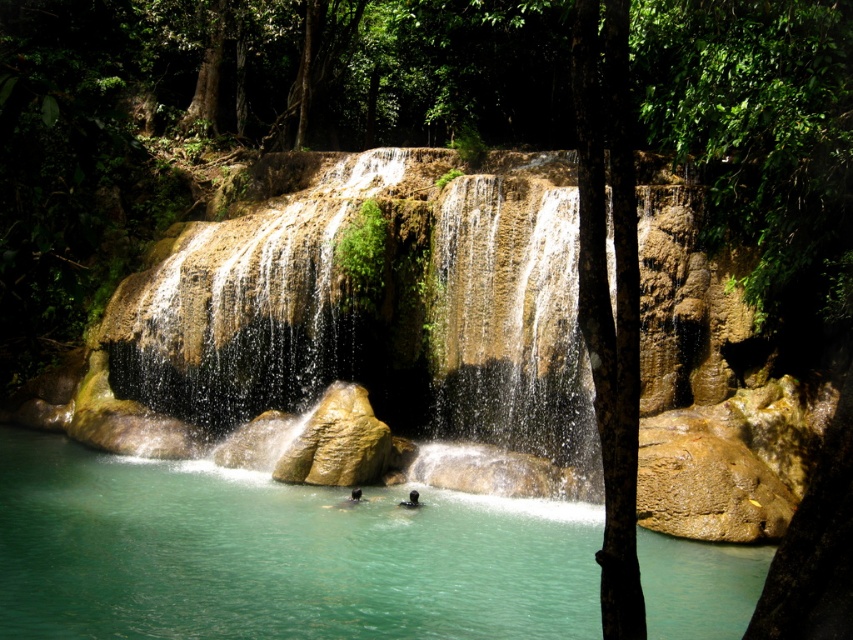
Question: Is clear turquoise water at center above smooth rock waterfall at center?

Choices:
 (A) yes
 (B) no

Answer: (B)

Question: Among these points, which one is nearest to the camera?

Choices:
 (A) (292, 193)
 (B) (459, 572)
 (C) (357, 492)
 (D) (413, 496)

Answer: (B)

Question: Which object is farther from the camera taking this photo?

Choices:
 (A) clear turquoise water at center
 (B) black matte person at center

Answer: (B)

Question: Can you confirm if clear turquoise water at center is thinner than black matte person at center?

Choices:
 (A) yes
 (B) no

Answer: (B)

Question: Is clear turquoise water at center further to camera compared to black matte person at center?

Choices:
 (A) yes
 (B) no

Answer: (B)

Question: Which object is the farthest from the black matte person at center?

Choices:
 (A) clear turquoise water at center
 (B) smooth rock waterfall at center

Answer: (B)